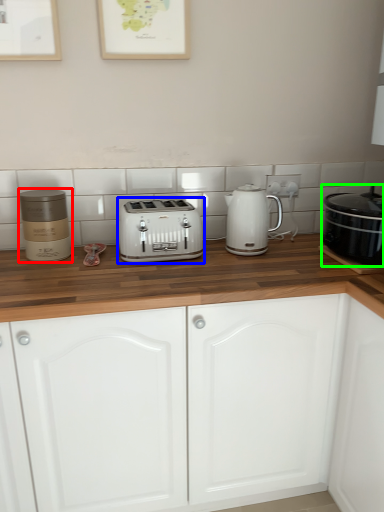
Question: Considering the real-world distances, which object is farthest from appliance (highlighted by a red box)? toaster (highlighted by a blue box) or home appliance (highlighted by a green box)?

Choices:
 (A) toaster
 (B) home appliance

Answer: (B)